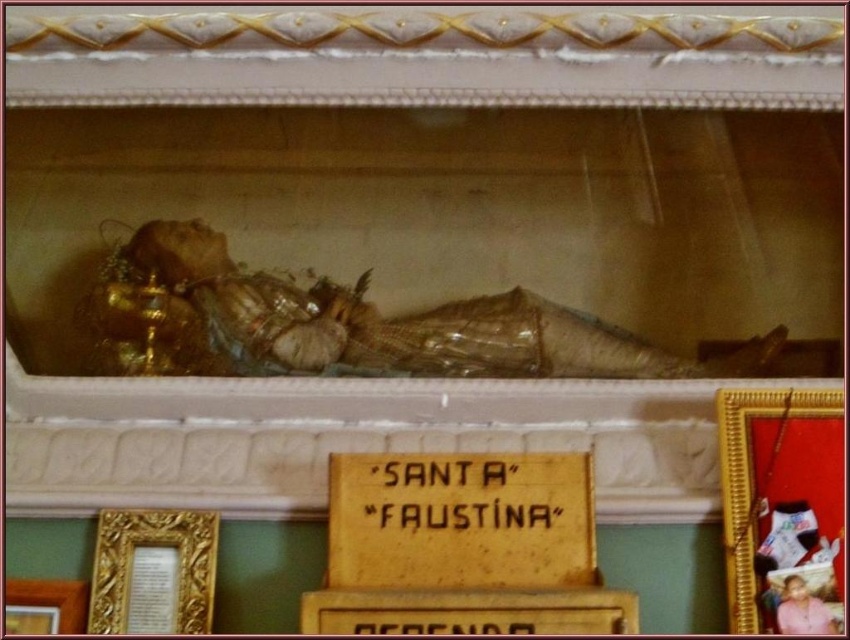
Who is higher up, wooden plaque at center or gold-framed picture at lower left?

wooden plaque at center is above.

Between point (374, 616) and point (38, 616), which one is positioned in front?

Point (374, 616) is more forward.

Where is `wooden plaque at center`? The height and width of the screenshot is (640, 850). wooden plaque at center is located at coordinates (469, 611).

Is point (159, 545) less distant than point (409, 618)?

No, it is behind (409, 618).

From the picture: Does gold ornate frame at lower left appear on the right side of wooden plaque at center?

Incorrect, gold ornate frame at lower left is not on the right side of wooden plaque at center.

Is point (98, 589) farther from camera compared to point (333, 616)?

Yes, point (98, 589) is farther from viewer.

Find the location of a particular element. gold ornate frame at lower left is located at coordinates (153, 572).

From the picture: Is gold-framed picture at center shorter than gold-framed picture at lower left?

In fact, gold-framed picture at center may be taller than gold-framed picture at lower left.

The height and width of the screenshot is (640, 850). What are the coordinates of `gold-framed picture at center` in the screenshot? It's located at (783, 508).

Measure the distance between gold-framed picture at center and camera.

The distance of gold-framed picture at center from camera is 2.75 meters.

Find the location of `gold-framed picture at center`. gold-framed picture at center is located at coordinates (783, 508).